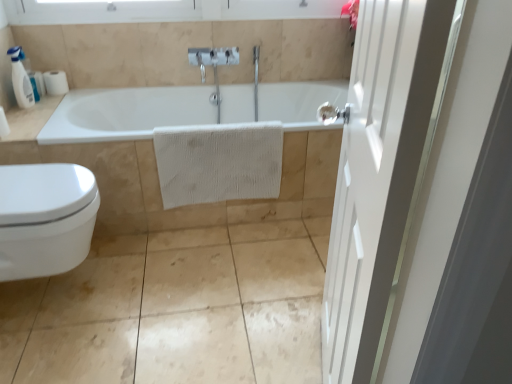
Question: Are white textured towel at center and white matte towel at center making contact?

Choices:
 (A) no
 (B) yes

Answer: (A)

Question: Is white textured towel at center to the left of white matte towel at center from the viewer's perspective?

Choices:
 (A) no
 (B) yes

Answer: (A)

Question: Considering the relative positions of white textured towel at center and white matte towel at center in the image provided, is white textured towel at center to the right of white matte towel at center from the viewer's perspective?

Choices:
 (A) yes
 (B) no

Answer: (A)

Question: From the image's perspective, is white textured towel at center beneath white matte towel at center?

Choices:
 (A) yes
 (B) no

Answer: (A)

Question: From a real-world perspective, is white textured towel at center positioned under white matte towel at center based on gravity?

Choices:
 (A) no
 (B) yes

Answer: (A)

Question: From the image's perspective, is white textured towel at center on white matte towel at center?

Choices:
 (A) yes
 (B) no

Answer: (B)

Question: Considering the relative positions of white glossy counter top at upper left and white textured towel at center in the image provided, is white glossy counter top at upper left in front of white textured towel at center?

Choices:
 (A) no
 (B) yes

Answer: (B)

Question: Is white glossy counter top at upper left taller than white textured towel at center?

Choices:
 (A) no
 (B) yes

Answer: (A)

Question: Are white glossy counter top at upper left and white textured towel at center beside each other?

Choices:
 (A) yes
 (B) no

Answer: (B)

Question: From a real-world perspective, is white glossy counter top at upper left over white textured towel at center?

Choices:
 (A) yes
 (B) no

Answer: (A)

Question: Is white textured towel at center at the back of white glossy counter top at upper left?

Choices:
 (A) no
 (B) yes

Answer: (A)

Question: Is white glossy counter top at upper left not near white textured towel at center?

Choices:
 (A) yes
 (B) no

Answer: (B)

Question: Considering the relative sizes of white glossy bidet at lower left and white matte toilet paper at upper left in the image provided, is white glossy bidet at lower left taller than white matte toilet paper at upper left?

Choices:
 (A) yes
 (B) no

Answer: (A)